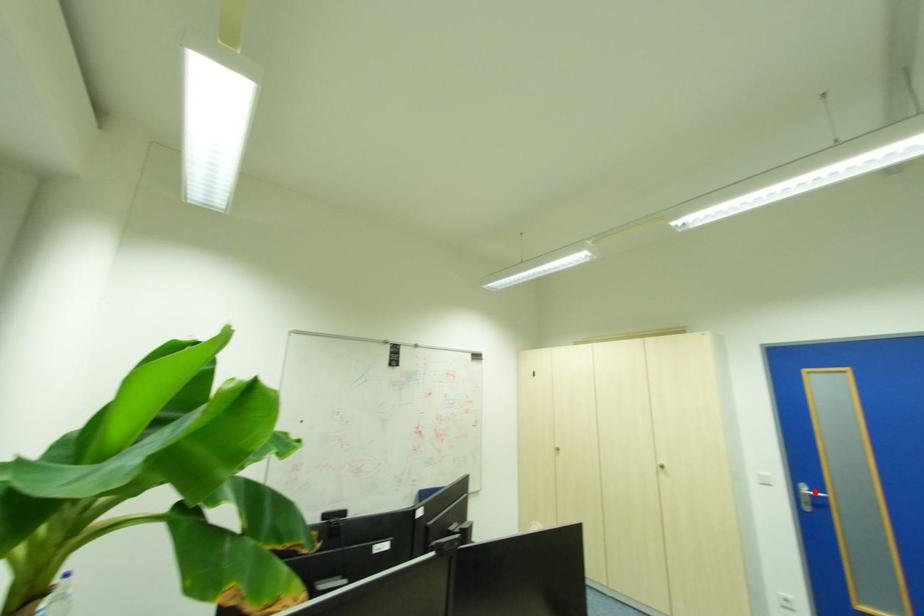
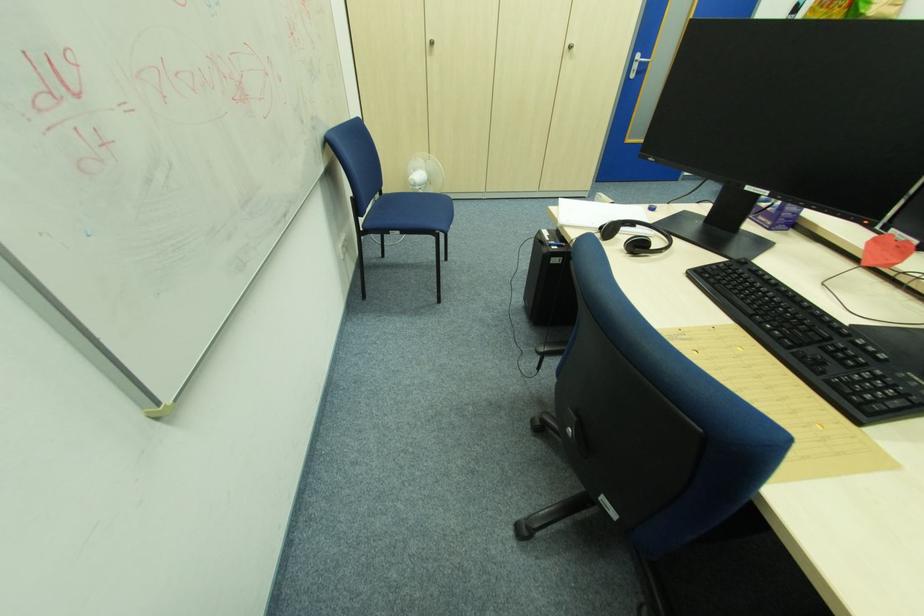
The point at the highlighted location is marked in the first image. Where is the corresponding point in the second image?

(647, 61)